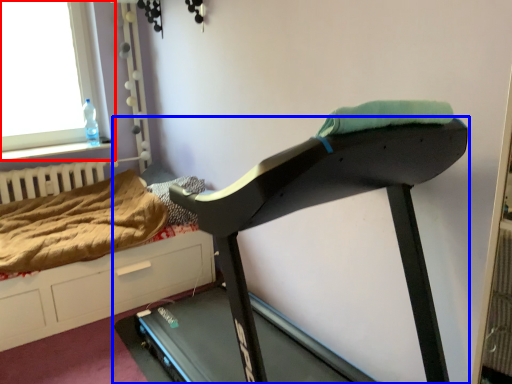
Question: Which of the following is the closest to the observer, window (highlighted by a red box) or treadmill (highlighted by a blue box)?

Choices:
 (A) window
 (B) treadmill

Answer: (B)